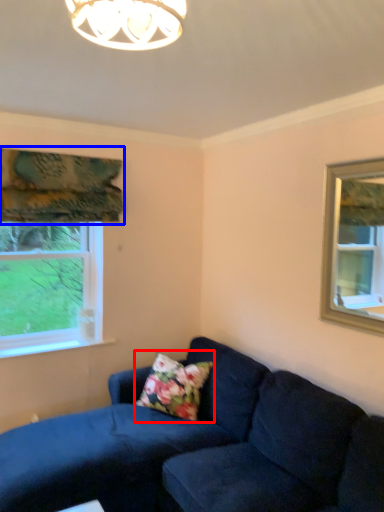
Question: Which point is closer to the camera, pillow (highlighted by a red box) or curtain (highlighted by a blue box)?

Choices:
 (A) pillow
 (B) curtain

Answer: (B)